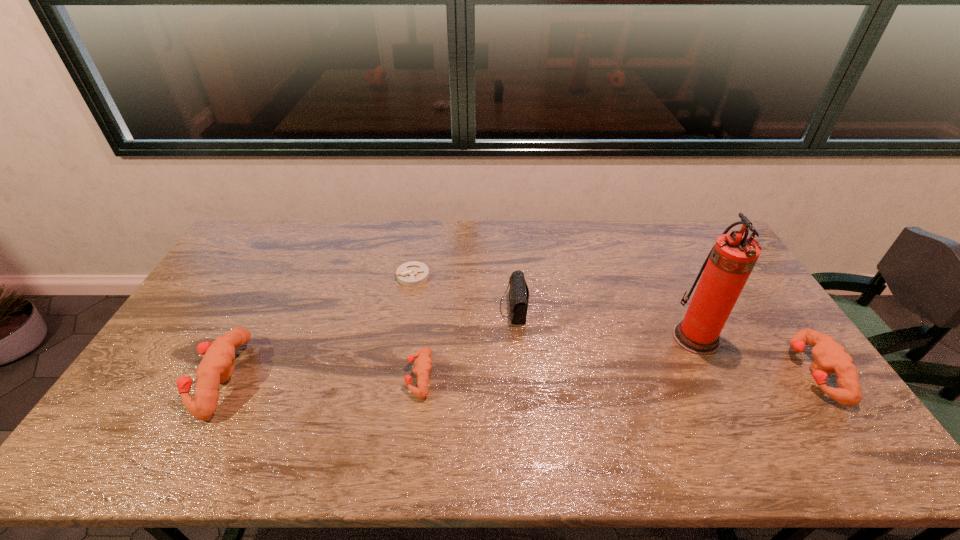
To make them evenly spaced by inserting another puncher among them, please locate a vacant spot for this new puncher. Please provide its 2D coordinates. Your answer should be formatted as a tuple, i.e. [(x, y)], where the tuple contains the x and y coordinates of a point satisfying the conditions above.

[(618, 374)]